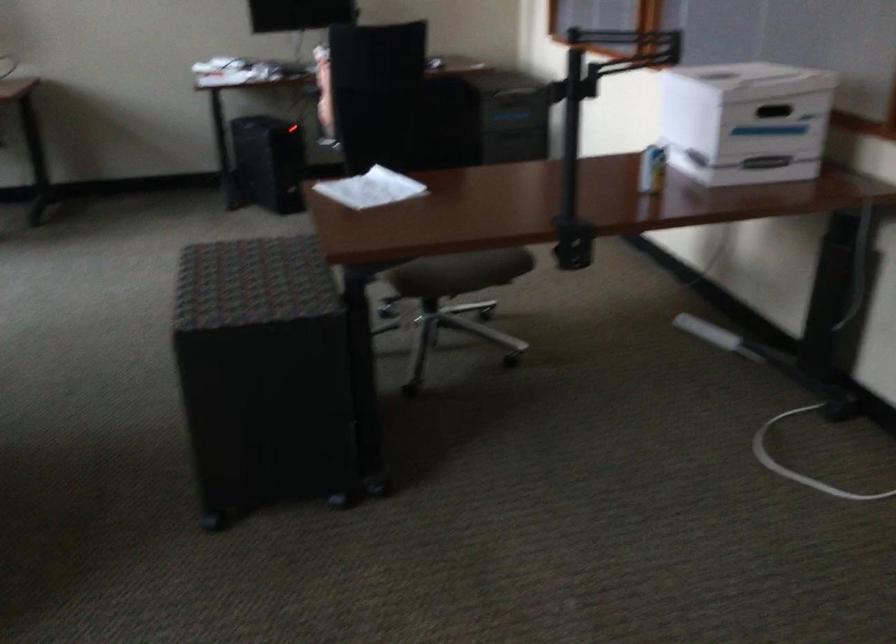
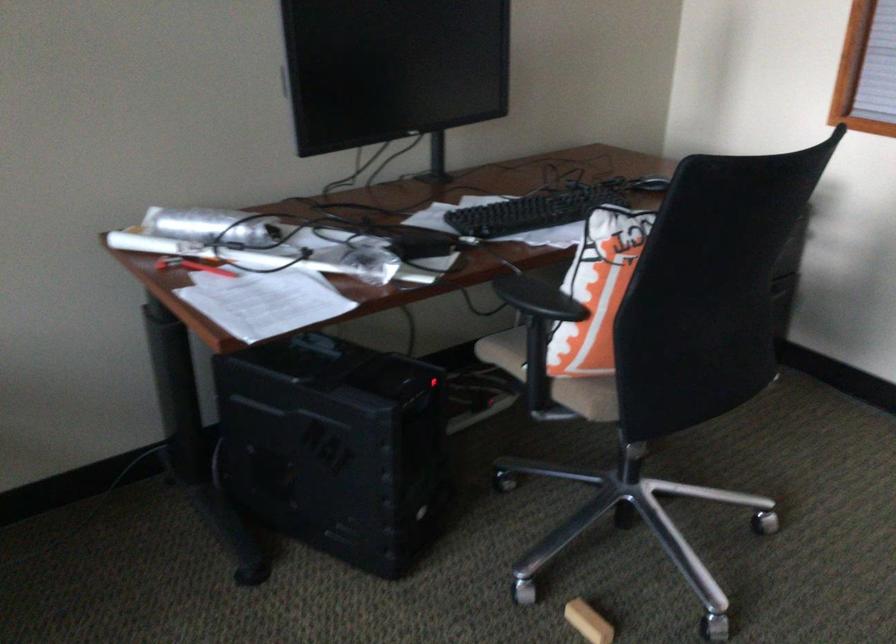
In the second image, find the point that corresponds to point 341,73 in the first image.

(597, 290)